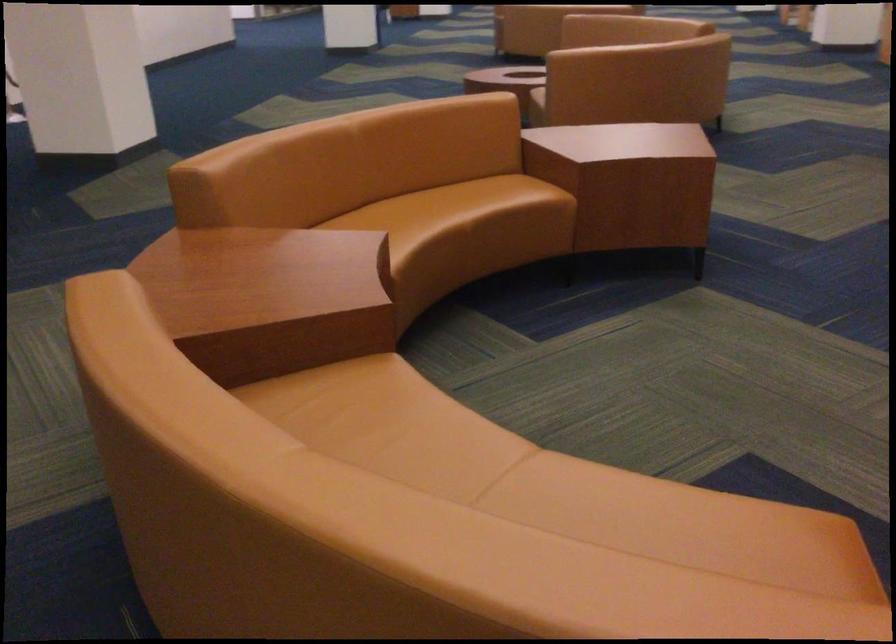
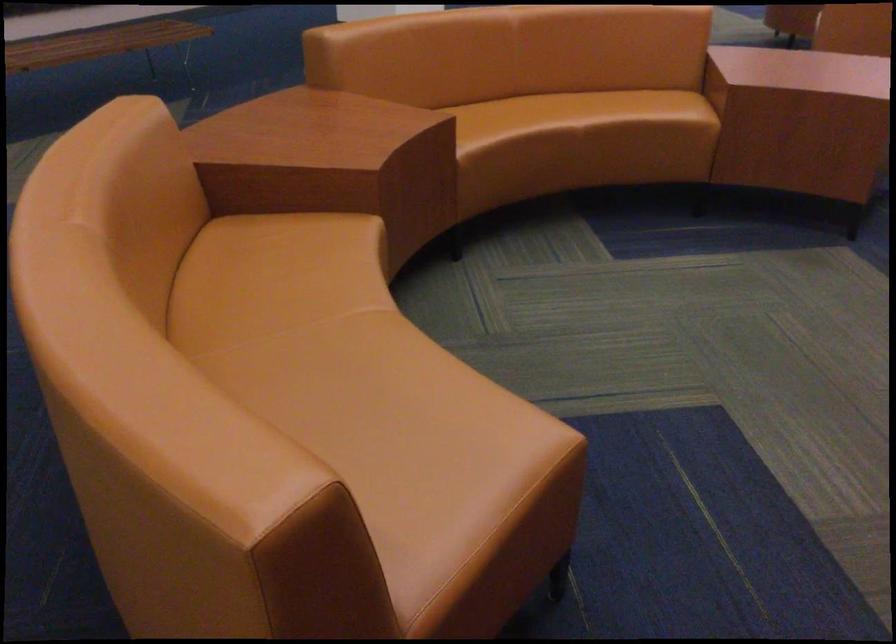
Question: What movement of the cameraman would produce the second image?

Choices:
 (A) Left
 (B) Right
 (C) Forward
 (D) Backward

Answer: (B)